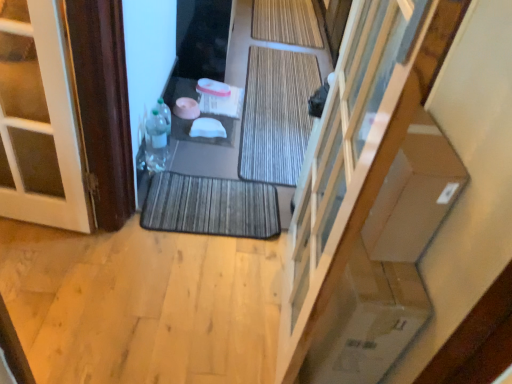
Question: Does natural bamboo bath mat at center, which is the 1th bath mat from back to front, lie in front of brown wood door at left?

Choices:
 (A) yes
 (B) no

Answer: (B)

Question: Considering the relative sizes of natural bamboo bath mat at center, the first bath mat in the top-to-bottom sequence, and brown wood door at left in the image provided, is natural bamboo bath mat at center, the first bath mat in the top-to-bottom sequence, bigger than brown wood door at left?

Choices:
 (A) no
 (B) yes

Answer: (A)

Question: From a real-world perspective, does natural bamboo bath mat at center, which is the 1th bath mat from back to front, stand above brown wood door at left?

Choices:
 (A) no
 (B) yes

Answer: (A)

Question: Is brown wood door at left completely or partially inside natural bamboo bath mat at center, marked as the 3th bath mat in a bottom-to-top arrangement?

Choices:
 (A) no
 (B) yes

Answer: (A)

Question: Is natural bamboo bath mat at center, the first bath mat in the top-to-bottom sequence, positioned behind brown wood door at left?

Choices:
 (A) yes
 (B) no

Answer: (A)

Question: Is dark gray textured bath mat at center, which is counted as the third bath mat, starting from the back, wider or thinner than brown wood door at left?

Choices:
 (A) wide
 (B) thin

Answer: (B)

Question: From a real-world perspective, is dark gray textured bath mat at center, which is counted as the third bath mat, starting from the back, physically located above or below brown wood door at left?

Choices:
 (A) below
 (B) above

Answer: (A)

Question: Considering their positions, is dark gray textured bath mat at center, which is counted as the third bath mat, starting from the back, located in front of or behind brown wood door at left?

Choices:
 (A) front
 (B) behind

Answer: (B)

Question: Considering the positions of point (226, 228) and point (33, 150), is point (226, 228) closer or farther from the camera than point (33, 150)?

Choices:
 (A) farther
 (B) closer

Answer: (A)

Question: From a real-world perspective, relative to translucent plastic bottle at left, which is the 1th bottle from bottom to top, is brown textured bath mat at center, the 2th bath mat viewed from the back, vertically above or below?

Choices:
 (A) above
 (B) below

Answer: (B)

Question: Is point (304, 77) closer or farther from the camera than point (150, 157)?

Choices:
 (A) closer
 (B) farther

Answer: (B)

Question: Considering the relative positions of brown textured bath mat at center, placed as the second bath mat when sorted from front to back, and translucent plastic bottle at left, which is the 1th bottle from bottom to top, in the image provided, is brown textured bath mat at center, placed as the second bath mat when sorted from front to back, to the left or to the right of translucent plastic bottle at left, which is the 1th bottle from bottom to top,?

Choices:
 (A) right
 (B) left

Answer: (A)

Question: Considering the positions of brown textured bath mat at center, marked as the second bath mat in a top-to-bottom arrangement, and translucent plastic bottle at left, which is the 1th bottle from bottom to top, in the image, is brown textured bath mat at center, marked as the second bath mat in a top-to-bottom arrangement, wider or thinner than translucent plastic bottle at left, which is the 1th bottle from bottom to top,?

Choices:
 (A) thin
 (B) wide

Answer: (B)

Question: Based on their positions, is transparent glass door at center located to the left or right of brown textured bath mat at center, placed as the second bath mat when sorted from front to back?

Choices:
 (A) left
 (B) right

Answer: (A)

Question: From the image's perspective, is transparent glass door at center positioned above or below brown textured bath mat at center, the 2th bath mat ordered from the bottom?

Choices:
 (A) below
 (B) above

Answer: (A)